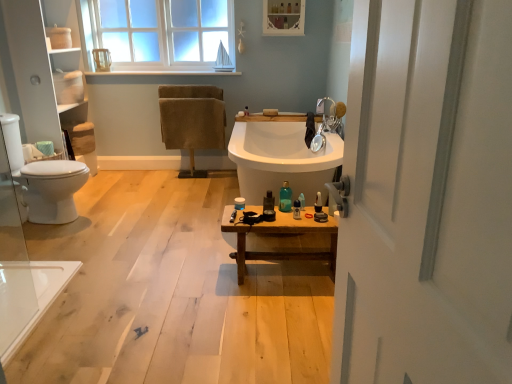
Find the location of a particular element. The height and width of the screenshot is (384, 512). vacant point to the right of translucent plastic bottle at center, marked as the 4th toiletry in a left-to-right arrangement is located at coordinates (314, 211).